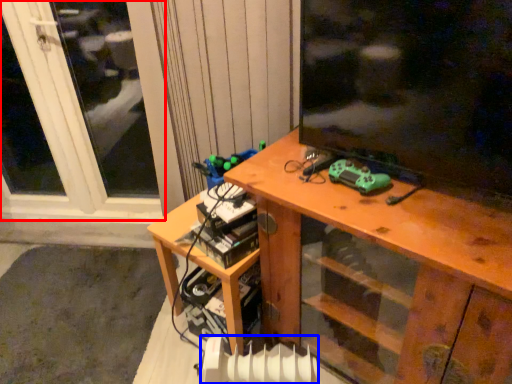
Question: Which of the following is the closest to the observer, window (highlighted by a red box) or radiator (highlighted by a blue box)?

Choices:
 (A) window
 (B) radiator

Answer: (B)